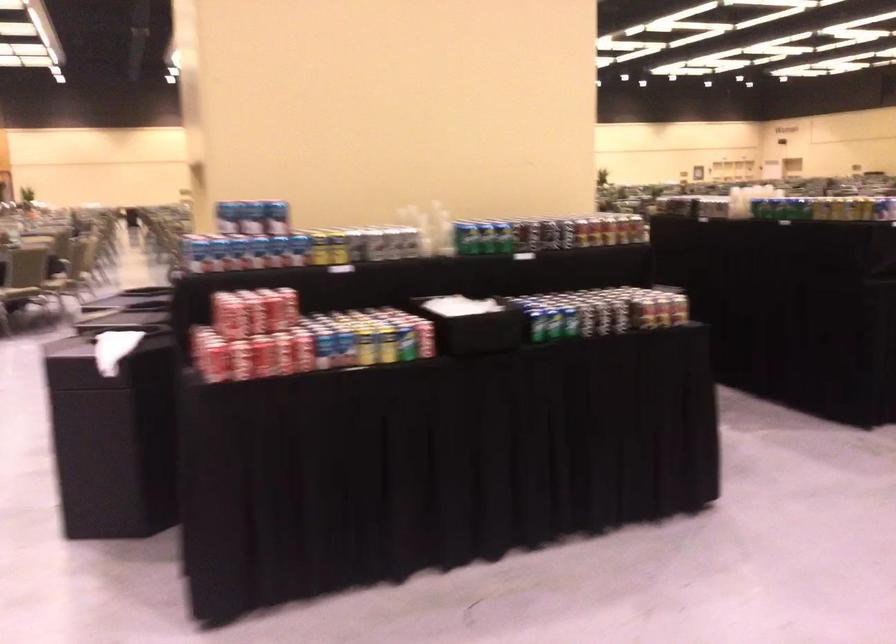
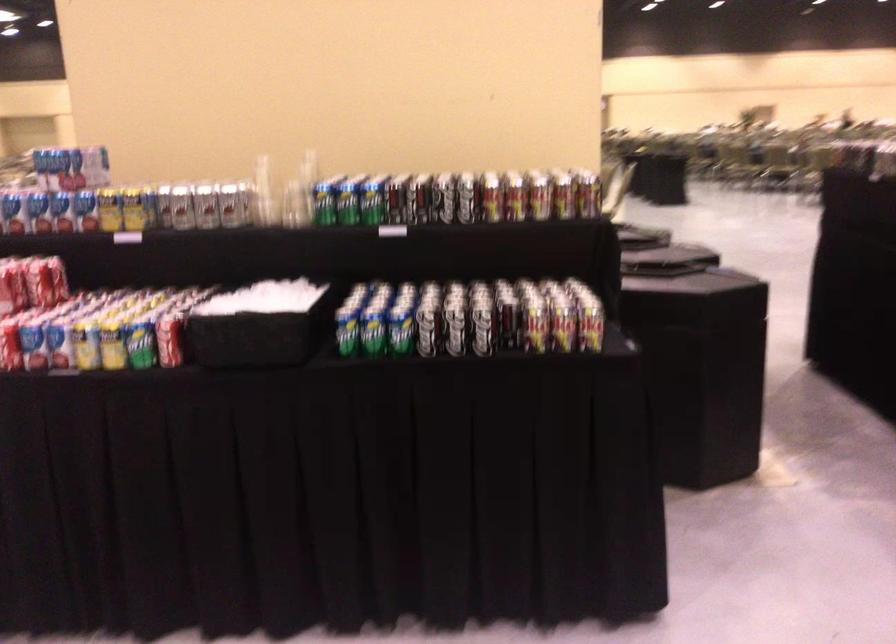
Where in the second image is the point corresponding to pixel 287 308 from the first image?

(40, 283)